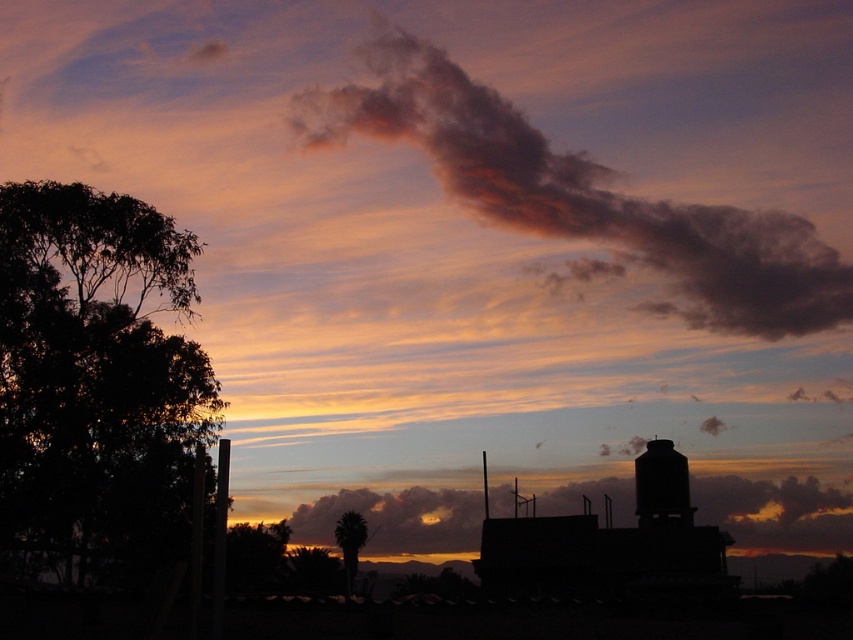
You are an artist trying to paint the sunset scene. You notice the smoky gray cloud at upper center and the cloudy sky at center. Which of these two objects is located higher in the image?

The smoky gray cloud at upper center is positioned over the cloudy sky at center, meaning it is higher up in the image.

You are an artist trying to paint this sunset scene. You want to ensure the green leafy tree at center and the smoky gray cloud at upper center are positioned correctly. Based on the scene description, which object should appear in front of the other?

The smoky gray cloud at upper center should appear in front of the green leafy tree at center because the tree is described as being behind the cloud.

You are an artist trying to paint the sunset scene. You notice the smoky gray cloud at upper center and the cloudy sky at center. Which one should you paint first if you want to follow the standard layering technique where closer objects are painted after distant ones?

The cloudy sky at center should be painted first because the smoky gray cloud at upper center is taller than it, implying it is closer and should be painted later.